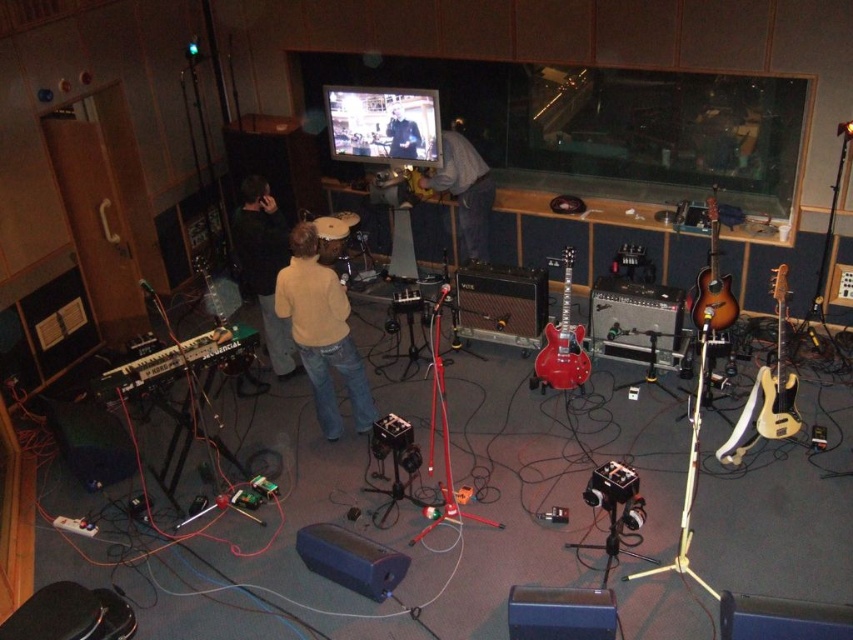
Who is positioned more to the left, yellow sweater at center or sunburst wood guitar at right?

yellow sweater at center

Does yellow sweater at center have a lesser height compared to sunburst wood guitar at right?

Incorrect, yellow sweater at center's height does not fall short of sunburst wood guitar at right's.

Between point (309, 339) and point (703, 273), which one is positioned behind?

Positioned behind is point (703, 273).

Locate an element on the screen. yellow sweater at center is located at coordinates (321, 332).

Does yellow sweater at center have a smaller size compared to gray fabric shirt at center?

Incorrect, yellow sweater at center is not smaller in size than gray fabric shirt at center.

Is yellow sweater at center to the left of gray fabric shirt at center from the viewer's perspective?

Yes, yellow sweater at center is to the left of gray fabric shirt at center.

The width and height of the screenshot is (853, 640). Find the location of `yellow sweater at center`. yellow sweater at center is located at coordinates (321, 332).

Which is behind, point (569, 364) or point (413, 157)?

Point (413, 157)

Does glossy red electric guitar at center lie behind dark gray sweater at center?

That is False.

What are the coordinates of `glossy red electric guitar at center` in the screenshot? It's located at (561, 342).